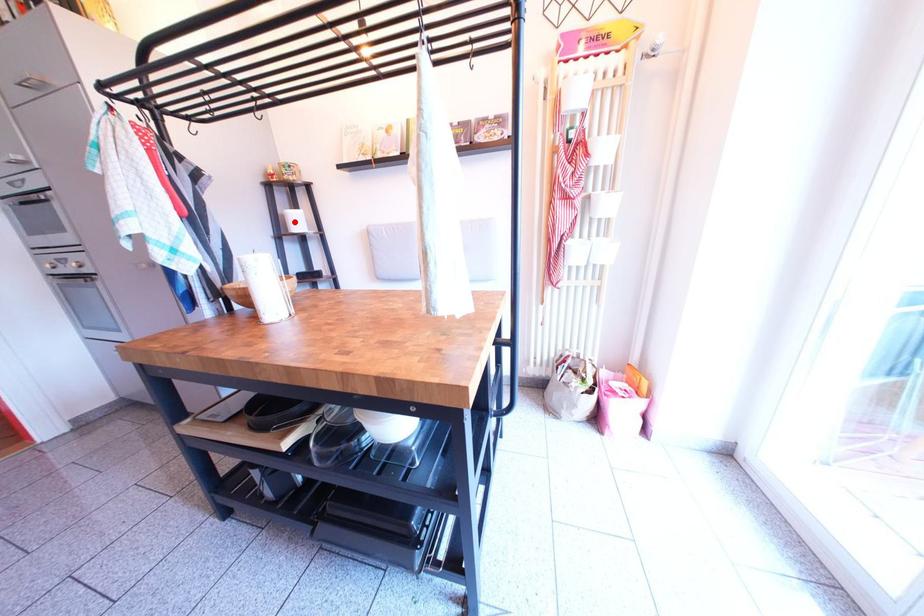
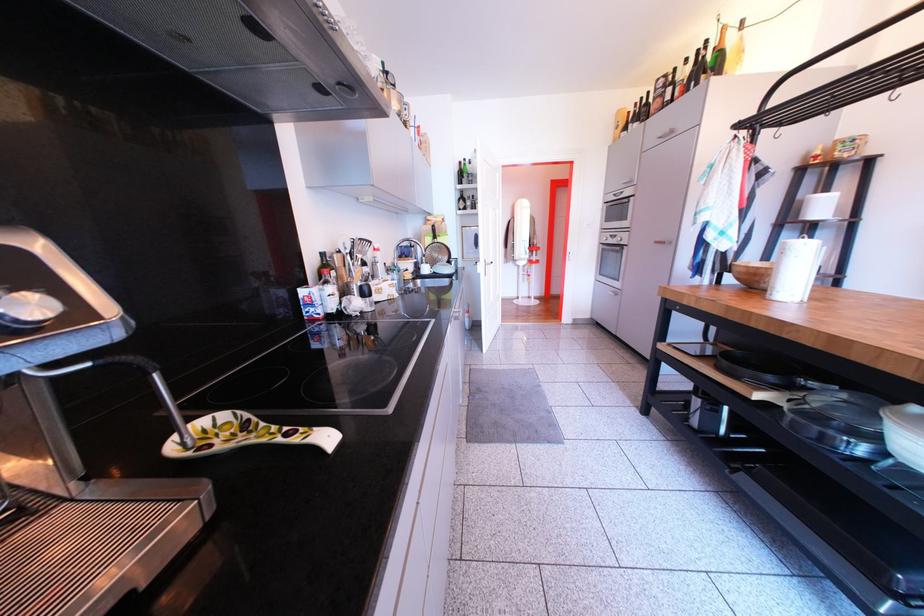
Question: I am providing you with two images of the same scene from different viewpoints. Image1 has a red point marked. In image2, the corresponding 3D location appears at what relative position? Reply with the corresponding letter.

Choices:
 (A) Closer
 (B) Farther

Answer: (B)